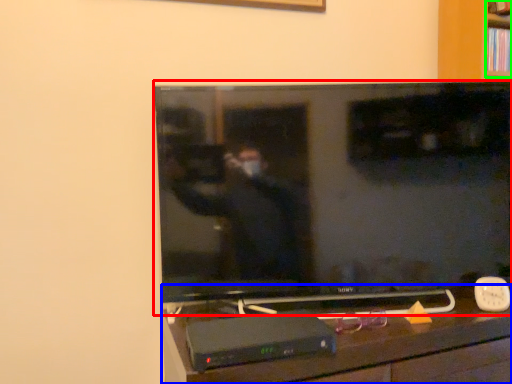
Question: Which object is positioned closest to television (highlighted by a red box)? Select from furniture (highlighted by a blue box) and shelf (highlighted by a green box).

Choices:
 (A) furniture
 (B) shelf

Answer: (A)